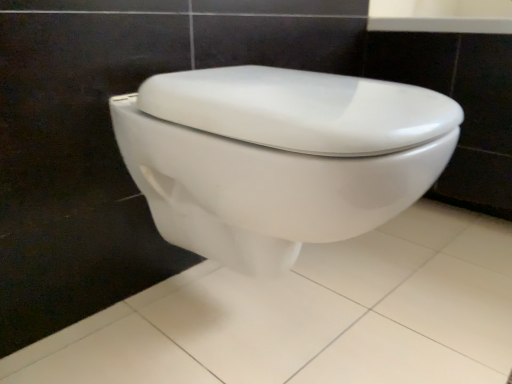
Identify the location of free space underneath white glossy toilet at center (from a real-world perspective). The image size is (512, 384). (280, 322).